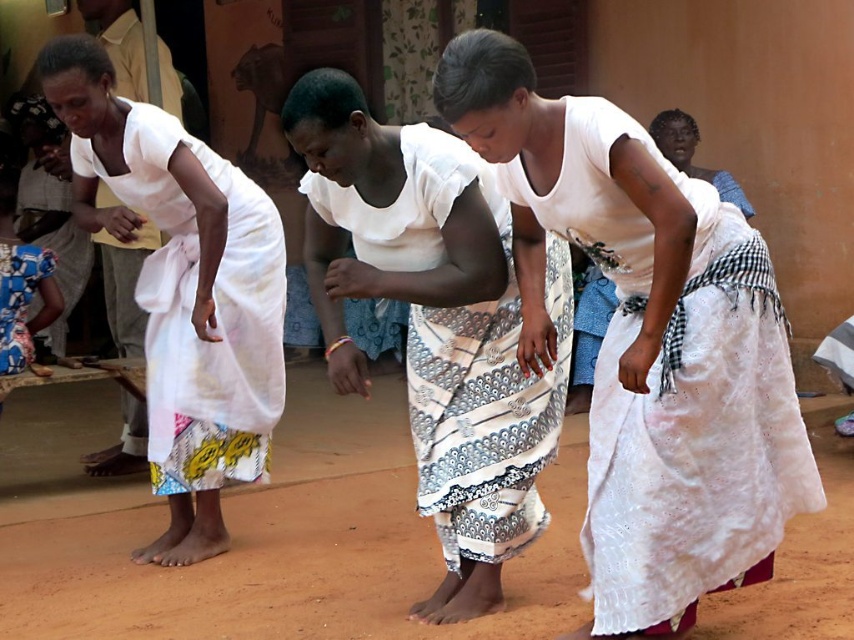
Question: Which object appears closest to the camera in this image?

Choices:
 (A) white textured cloth at center
 (B) white lace cloth at upper right

Answer: (A)

Question: Is white printed fabric skirt at center to the right of white woven cloth at left from the viewer's perspective?

Choices:
 (A) yes
 (B) no

Answer: (A)

Question: Which point is farther to the camera?

Choices:
 (A) white textured cloth at center
 (B) white printed fabric skirt at center
 (C) white woven cloth at left
 (D) blue and white printed fabric dress at lower left

Answer: (D)

Question: Does white printed fabric skirt at center appear over white lace cloth at upper right?

Choices:
 (A) no
 (B) yes

Answer: (A)

Question: Estimate the real-world distances between objects in this image. Which object is farther from the blue and white printed fabric dress at lower left?

Choices:
 (A) white woven cloth at left
 (B) white lace cloth at upper right
 (C) white textured cloth at center
 (D) white printed fabric skirt at center

Answer: (B)

Question: Can you confirm if blue and white printed fabric dress at lower left is thinner than white lace cloth at upper right?

Choices:
 (A) no
 (B) yes

Answer: (B)